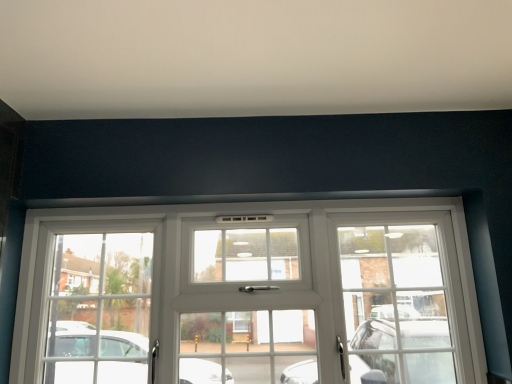
Identify the location of white glass door at center. Image resolution: width=512 pixels, height=384 pixels. (251, 294).

What do you see at coordinates (251, 294) in the screenshot? I see `white glass door at center` at bounding box center [251, 294].

Image resolution: width=512 pixels, height=384 pixels. Identify the location of white glass door at center. (251, 294).